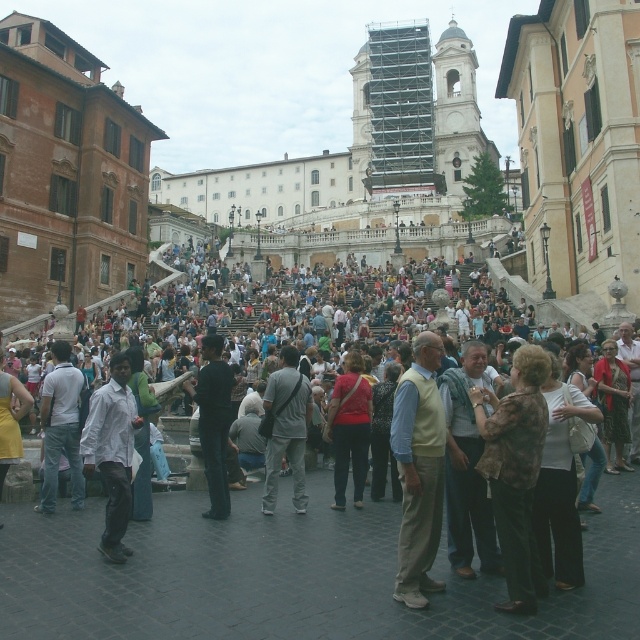
Question: Estimate the real-world distances between objects in this image. Which object is closer to the brown textured coat at lower right?

Choices:
 (A) gray cotton shirt at center
 (B) matte red sweater at center

Answer: (B)

Question: Among these objects, which one is nearest to the camera?

Choices:
 (A) brown textured coat at lower right
 (B) brown textured shirt at lower right
 (C) gray cotton shirt at center

Answer: (A)

Question: Considering the relative positions of gray cotton shirt at center and red shirt at center in the image provided, where is gray cotton shirt at center located with respect to red shirt at center?

Choices:
 (A) right
 (B) left

Answer: (B)

Question: Does brown textured coat at lower right appear on the right side of gray cotton shirt at center?

Choices:
 (A) no
 (B) yes

Answer: (B)

Question: Can you confirm if gray cotton shirt at center is smaller than matte red sweater at center?

Choices:
 (A) yes
 (B) no

Answer: (B)

Question: Which of the following is the closest to the observer?

Choices:
 (A) (529, 593)
 (B) (272, 451)

Answer: (A)